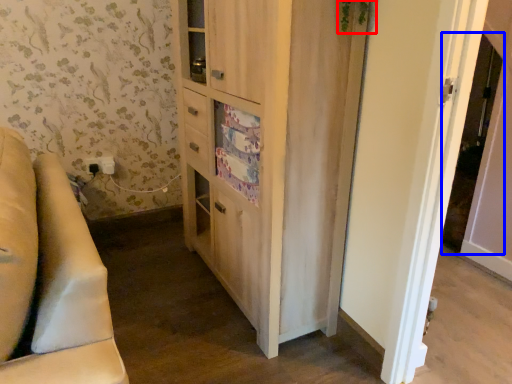
Question: Which of the following is the closest to the observer, plant (highlighted by a red box) or screen door (highlighted by a blue box)?

Choices:
 (A) plant
 (B) screen door

Answer: (A)